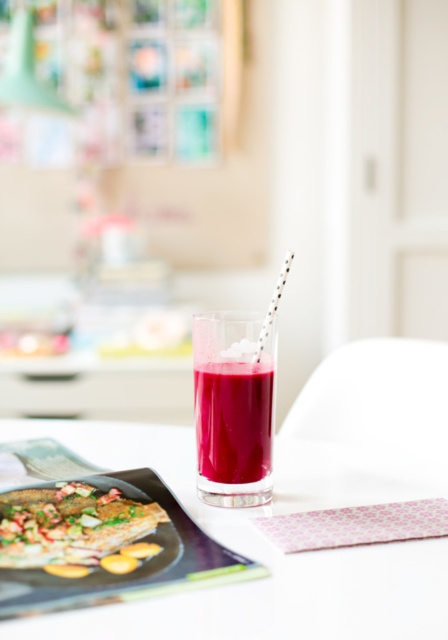
Does transparent glass at center have a greater height compared to silver metallic straw at center?

No.

Which is behind, point (215, 529) or point (275, 291)?

The point (275, 291) is behind.

Locate an element on the screen. transparent glass at center is located at coordinates (270, 545).

Who is higher up, shiny silver fish at center or silver metallic straw at center?

silver metallic straw at center is higher up.

What do you see at coordinates (73, 528) in the screenshot? I see `shiny silver fish at center` at bounding box center [73, 528].

Does point (21, 557) come in front of point (255, 362)?

Yes, point (21, 557) is closer to viewer.

Where is `shiny silver fish at center`? This screenshot has width=448, height=640. shiny silver fish at center is located at coordinates (73, 528).

Who is more distant from viewer, [214,404] or [275,301]?

The point [214,404] is behind.

In order to click on translucent glass at center in this screenshot , I will do `click(233, 420)`.